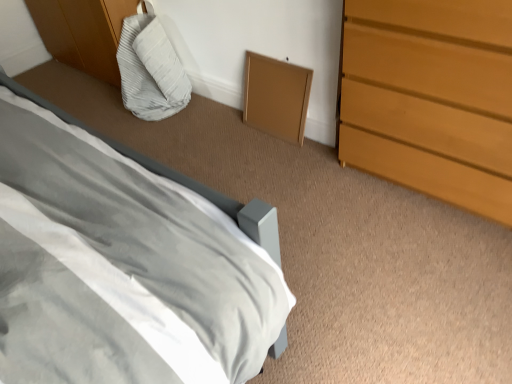
Question: Is point (165, 66) positioned closer to the camera than point (481, 26)?

Choices:
 (A) farther
 (B) closer

Answer: (A)

Question: Is light gray fabric bean bag at upper left in front of or behind light brown wooden chest of drawers at right in the image?

Choices:
 (A) behind
 (B) front

Answer: (A)

Question: Estimate the real-world distances between objects in this image. Which object is closer to the matte gray bed at lower left?

Choices:
 (A) light gray fabric bean bag at upper left
 (B) light brown wooden chest of drawers at right

Answer: (B)

Question: Considering the real-world distances, which object is closest to the light brown wooden chest of drawers at right?

Choices:
 (A) matte gray bed at lower left
 (B) light gray fabric bean bag at upper left

Answer: (A)